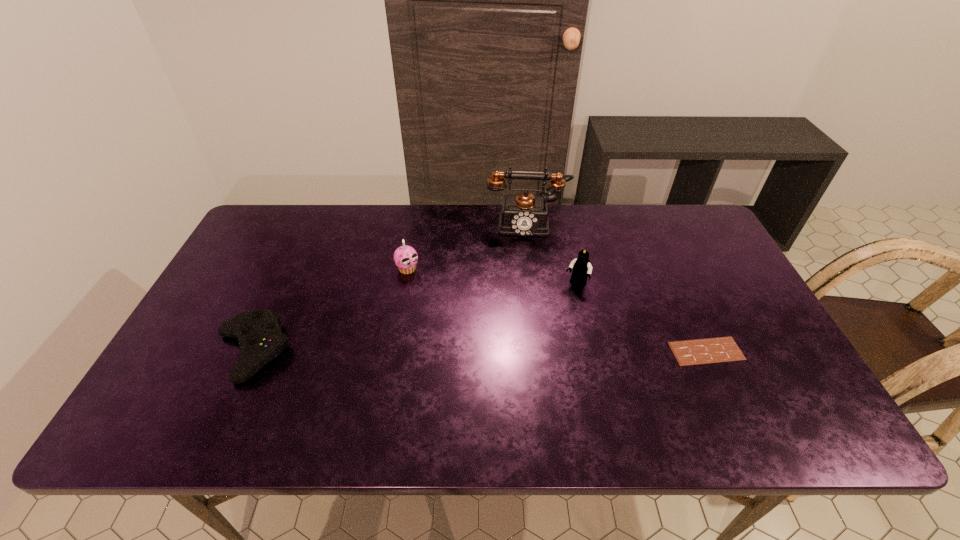
Identify the location of the fourth tallest object. (260, 337).

Find the location of `the leftmost object`. the leftmost object is located at coordinates click(x=260, y=337).

Where is `chocolate bar`? The height and width of the screenshot is (540, 960). chocolate bar is located at coordinates (722, 349).

The image size is (960, 540). Find the location of `the rightmost object`. the rightmost object is located at coordinates (722, 349).

Find the location of a particular element. This screenshot has height=540, width=960. the second object from left to right is located at coordinates (405, 257).

Locate an element on the screen. This screenshot has height=540, width=960. Lego is located at coordinates (581, 267).

Image resolution: width=960 pixels, height=540 pixels. Identify the location of the farthest object. (524, 214).

Locate an element on the screen. Image resolution: width=960 pixels, height=540 pixels. the tallest object is located at coordinates (524, 214).

Locate an element on the screen. free space located on the right of the fourth tallest object is located at coordinates (384, 352).

Find the location of a particular element. This screenshot has height=540, width=960. vacant space located 0.180m on the left of the chocolate bar is located at coordinates (598, 351).